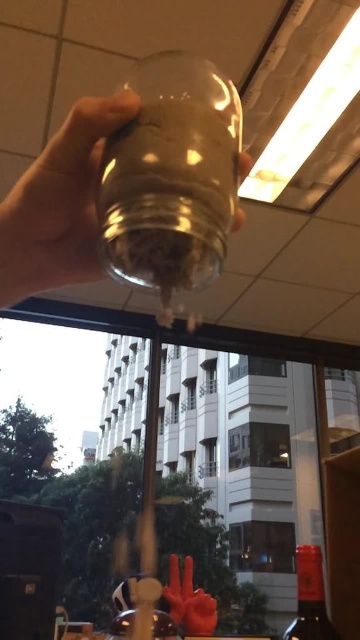
You are a delivery person who needs to place a transparent glass jar at upper left on a shelf that is 12 inches wide. Can the jar fit on the shelf?

The transparent glass jar at upper left is 11.35 inches in width, so it will fit on the 12 inch wide shelf with some space remaining.

You are an architect designing a new building. You want to place a transparent glass jar at upper left in the same position as the one in the image. What coordinates should you use?

The transparent glass jar at upper left should be placed at coordinates point [59,204].

You are holding a transparent glass jar at upper left and want to place it on a shelf that is 12 inches away from you. Can you reach the shelf without moving your body?

The transparent glass jar at upper left and viewer are 11.35 inches apart from each other, so yes, you can reach the shelf since the distance is within your arm length.